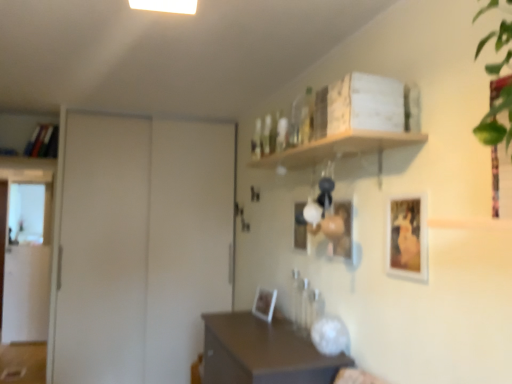
The height and width of the screenshot is (384, 512). I want to click on free space above brown matte table at center (from a real-world perspective), so click(x=258, y=321).